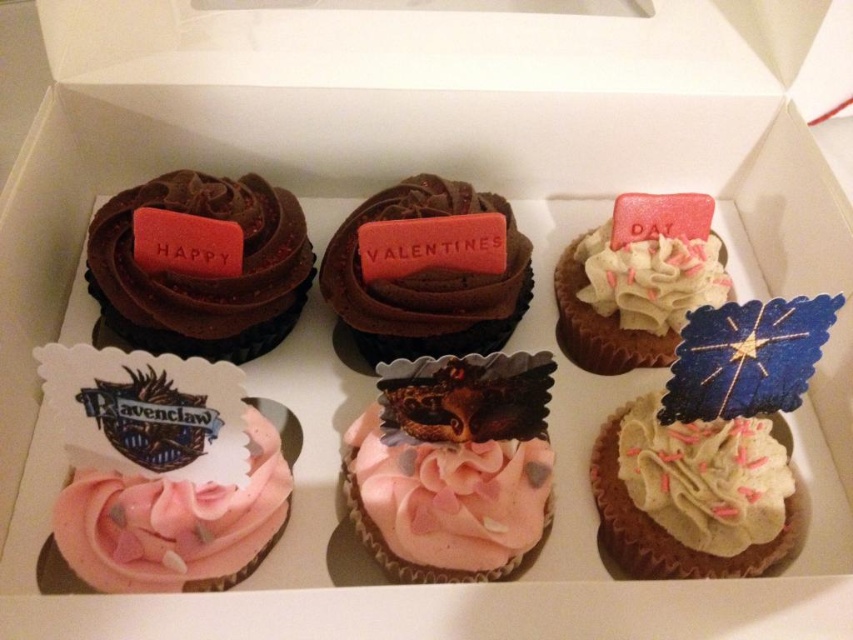
Which is behind, point (380, 486) or point (331, 268)?

Positioned behind is point (331, 268).

Which is in front, point (440, 490) or point (526, 301)?

Point (440, 490) is more forward.

Is point (352, 468) less distant than point (482, 348)?

Yes, point (352, 468) is closer to viewer.

Locate an element on the screen. This screenshot has width=853, height=640. pink buttercream at center is located at coordinates (445, 499).

Can you confirm if creamy vanilla cupcake at center-right is wider than pink frosted cupcake at upper right?

Incorrect, creamy vanilla cupcake at center-right's width does not surpass pink frosted cupcake at upper right's.

Identify the location of creamy vanilla cupcake at center-right. (692, 493).

Is chocolate matte at upper left further to camera compared to pink frosted cupcake at upper right?

No.

Describe the element at coordinates (202, 275) in the screenshot. I see `chocolate matte at upper left` at that location.

Is point (311, 280) farther from camera compared to point (634, 307)?

Yes, point (311, 280) is farther from viewer.

In order to click on chocolate matte at upper left in this screenshot , I will do `click(202, 275)`.